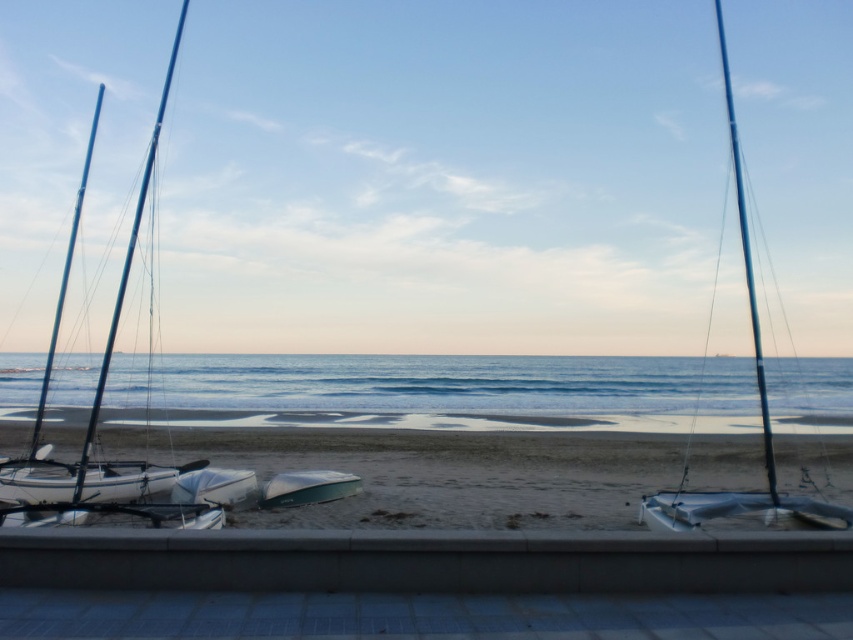
Question: Is blue water at center above green matte boat at center?

Choices:
 (A) no
 (B) yes

Answer: (A)

Question: Which object is farther from the camera taking this photo?

Choices:
 (A) white matte sailboat at center
 (B) white matte sailboat at left
 (C) shiny blue sailboat at right

Answer: (A)

Question: Does white matte sailboat at left have a lesser width compared to white matte sailboat at center?

Choices:
 (A) yes
 (B) no

Answer: (B)

Question: Which object appears farthest from the camera in this image?

Choices:
 (A) smooth sand at lower center
 (B) blue water at center
 (C) green matte boat at center
 (D) white matte sailboat at left

Answer: (B)

Question: Is blue water at center positioned behind shiny blue sailboat at right?

Choices:
 (A) no
 (B) yes

Answer: (B)

Question: Which object is closer to the camera taking this photo?

Choices:
 (A) white matte sailboat at left
 (B) smooth sand at lower center

Answer: (A)